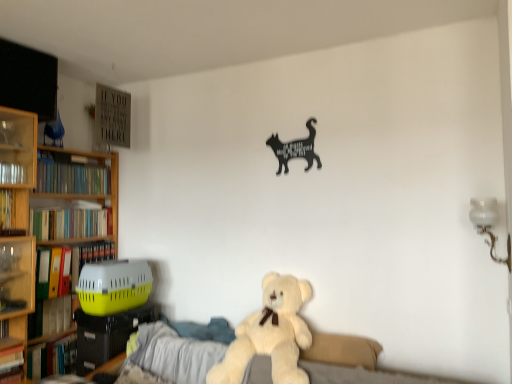
Question: From the image's perspective, is hardcover books at left, placed as the 3th book when sorted from top to bottom, located above hardcover book at left, arranged as the 2th book when viewed from the top?

Choices:
 (A) yes
 (B) no

Answer: (B)

Question: Is hardcover books at left, the fifth book positioned from the bottom, behind hardcover book at left, placed as the 6th book when sorted from bottom to top?

Choices:
 (A) no
 (B) yes

Answer: (B)

Question: From the image's perspective, is hardcover books at left, placed as the 3th book when sorted from top to bottom, beneath hardcover book at left, arranged as the 2th book when viewed from the top?

Choices:
 (A) no
 (B) yes

Answer: (B)

Question: Is hardcover books at left, the fifth book positioned from the bottom, bigger than hardcover book at left, placed as the 6th book when sorted from bottom to top?

Choices:
 (A) yes
 (B) no

Answer: (A)

Question: Can you confirm if hardcover books at left, placed as the 3th book when sorted from top to bottom, is shorter than hardcover book at left, arranged as the 2th book when viewed from the top?

Choices:
 (A) no
 (B) yes

Answer: (B)

Question: From a real-world perspective, relative to green matte bookshelf at left, which is counted as the seventh book, starting from the bottom, is fluffy white teddy bear at center vertically above or below?

Choices:
 (A) above
 (B) below

Answer: (B)

Question: From the image's perspective, relative to green matte bookshelf at left, which ranks as the first book in top-to-bottom order, is fluffy white teddy bear at center above or below?

Choices:
 (A) below
 (B) above

Answer: (A)

Question: Does point (246, 329) appear closer or farther from the camera than point (89, 177)?

Choices:
 (A) closer
 (B) farther

Answer: (A)

Question: Considering their positions, is fluffy white teddy bear at center located in front of or behind green matte bookshelf at left, which ranks as the first book in top-to-bottom order?

Choices:
 (A) behind
 (B) front

Answer: (B)

Question: Is hardcover book at left, positioned as the 1th book in bottom-to-top order, bigger or smaller than yellow matte folder at left, positioned as the 4th book in top-to-bottom order?

Choices:
 (A) small
 (B) big

Answer: (A)

Question: In terms of width, does hardcover book at left, the 7th book when ordered from top to bottom, look wider or thinner when compared to yellow matte folder at left, positioned as the 4th book in top-to-bottom order?

Choices:
 (A) wide
 (B) thin

Answer: (B)

Question: From a real-world perspective, is hardcover book at left, the 7th book when ordered from top to bottom, above or below yellow matte folder at left, the 4th book in the bottom-to-top sequence?

Choices:
 (A) below
 (B) above

Answer: (A)

Question: In the image, is hardcover book at left, positioned as the 1th book in bottom-to-top order, on the left side or the right side of yellow matte folder at left, the 4th book in the bottom-to-top sequence?

Choices:
 (A) right
 (B) left

Answer: (B)

Question: In terms of height, does hardcover book at left, positioned as the 1th book in bottom-to-top order, look taller or shorter compared to green matte bookshelf at left, which is counted as the seventh book, starting from the bottom?

Choices:
 (A) short
 (B) tall

Answer: (B)

Question: Based on their positions, is hardcover book at left, positioned as the 1th book in bottom-to-top order, located to the left or right of green matte bookshelf at left, which ranks as the first book in top-to-bottom order?

Choices:
 (A) right
 (B) left

Answer: (B)